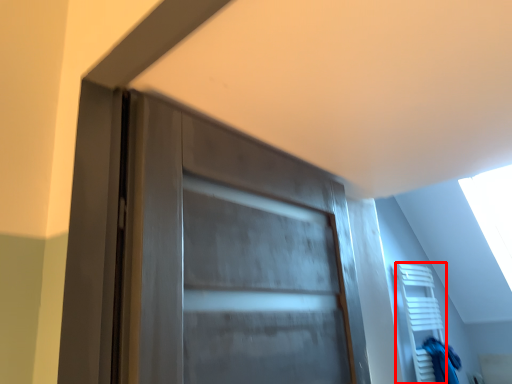
Question: From the image's perspective, what is the correct spatial positioning of shelf (annotated by the red box) in reference to scrub?

Choices:
 (A) above
 (B) below

Answer: (A)